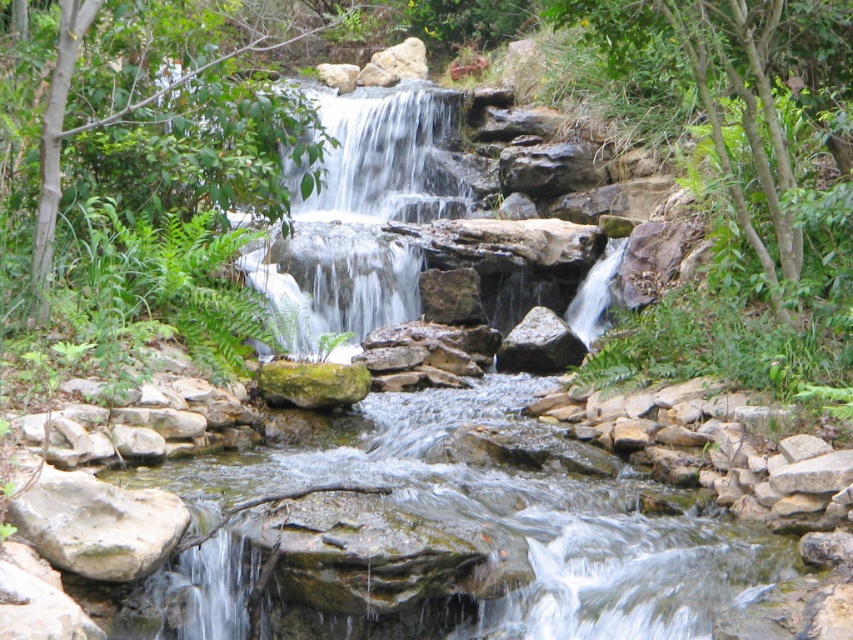
Question: Which point is farther to the camera?

Choices:
 (A) white textured water at center
 (B) gray rough rock at lower left
 (C) green mossy rock at center

Answer: (A)

Question: Can you confirm if green mossy rock at center is thinner than white textured water at center?

Choices:
 (A) yes
 (B) no

Answer: (A)

Question: Can you confirm if gray rough rock at lower left is bigger than gray rough rock at center?

Choices:
 (A) no
 (B) yes

Answer: (A)

Question: Which object appears closest to the camera in this image?

Choices:
 (A) white textured water at center
 (B) green mossy rock at center
 (C) gray rough rock at lower left
 (D) gray rough rock at center

Answer: (C)

Question: From the image, what is the correct spatial relationship of gray rough rock at lower left in relation to gray rough rock at center?

Choices:
 (A) above
 (B) below

Answer: (B)

Question: Which of these objects is positioned closest to the gray rough rock at lower left?

Choices:
 (A) green mossy rock at center
 (B) gray rough rock at center
 (C) white textured water at center

Answer: (A)